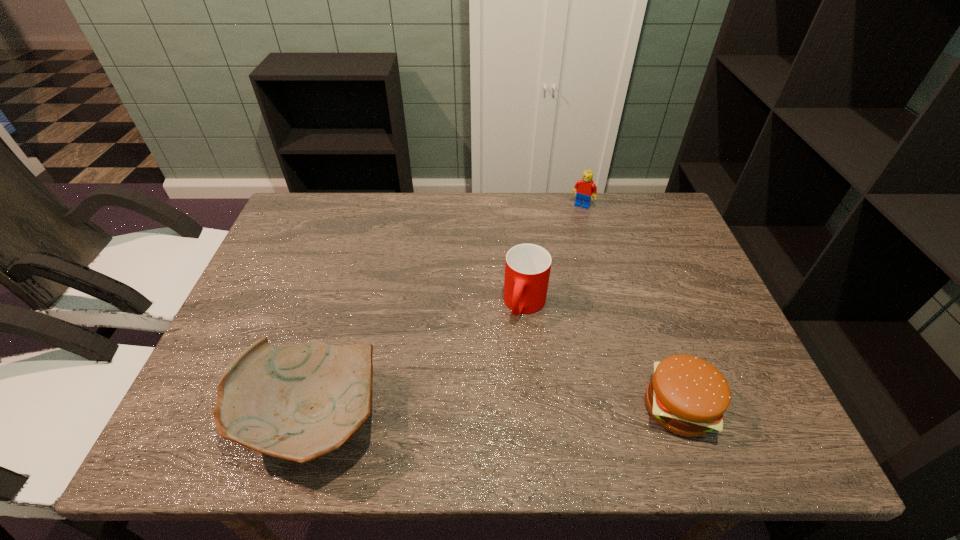
This screenshot has height=540, width=960. Find the location of `vacant area that lies between the cup and the shortest object`. vacant area that lies between the cup and the shortest object is located at coordinates (602, 355).

Where is `empty space that is in between the Lego and the third object from right to left`? empty space that is in between the Lego and the third object from right to left is located at coordinates (554, 255).

Image resolution: width=960 pixels, height=540 pixels. What are the coordinates of `vacant area that lies between the Lego and the leftmost object` in the screenshot? It's located at (446, 312).

I want to click on free space between the farthest object and the third object from right to left, so click(554, 255).

The width and height of the screenshot is (960, 540). What are the coordinates of `vacant space in between the shortest object and the farthest object` in the screenshot? It's located at (631, 306).

At what (x,y) coordinates should I click in order to perform the action: click on free space between the pottery and the second object from left to right. Please return your answer as a coordinate pair (x, y). This screenshot has height=540, width=960. Looking at the image, I should click on (419, 361).

I want to click on the second closest object to the leftmost object, so click(688, 396).

The height and width of the screenshot is (540, 960). I want to click on the third closest object to the Lego, so click(299, 403).

Locate an element on the screen. vacant space that satisfies the following two spatial constraints: 1. on the front side of the third object from right to left; 2. on the left side of the shortest object is located at coordinates (535, 407).